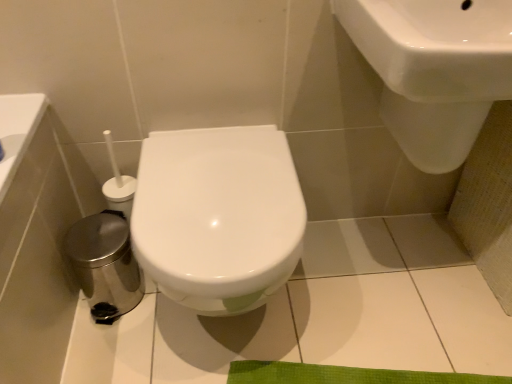
Question: From a real-world perspective, is white glossy toilet at center positioned above or below white glossy sink at upper right?

Choices:
 (A) below
 (B) above

Answer: (A)

Question: Based on their positions, is white glossy toilet at center located to the left or right of white glossy sink at upper right?

Choices:
 (A) right
 (B) left

Answer: (B)

Question: From the image's perspective, is white glossy toilet at center positioned above or below white glossy sink at upper right?

Choices:
 (A) above
 (B) below

Answer: (B)

Question: Considering the positions of white glossy sink at upper right and white glossy toilet at center in the image, is white glossy sink at upper right taller or shorter than white glossy toilet at center?

Choices:
 (A) tall
 (B) short

Answer: (B)

Question: Do you think white glossy sink at upper right is within white glossy toilet at center, or outside of it?

Choices:
 (A) outside
 (B) inside

Answer: (A)

Question: Considering the positions of white glossy sink at upper right and white glossy toilet at center in the image, is white glossy sink at upper right wider or thinner than white glossy toilet at center?

Choices:
 (A) thin
 (B) wide

Answer: (A)

Question: Looking at the image, does white glossy sink at upper right seem bigger or smaller compared to white glossy toilet at center?

Choices:
 (A) small
 (B) big

Answer: (A)